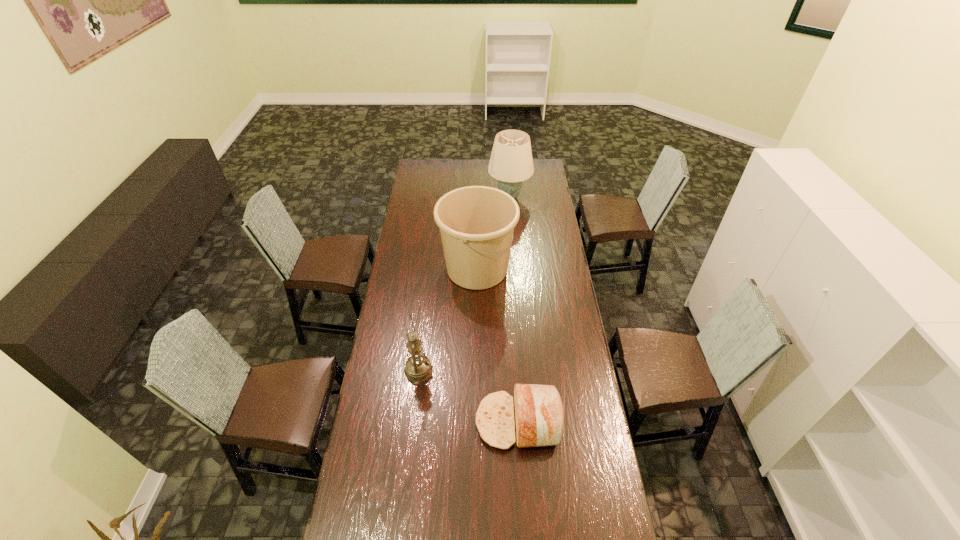
Select which object is the third closest to the oil lamp. Please provide its 2D coordinates. Your answer should be formatted as a tuple, i.e. [(x, y)], where the tuple contains the x and y coordinates of a point satisfying the conditions above.

[(511, 162)]

At what (x,y) coordinates should I click in order to perform the action: click on vacant space that satisfies the following two spatial constraints: 1. on the front side of the farthest object; 2. at the sliced end of the bread. Please return your answer as a coordinate pair (x, y). The width and height of the screenshot is (960, 540). Looking at the image, I should click on (527, 421).